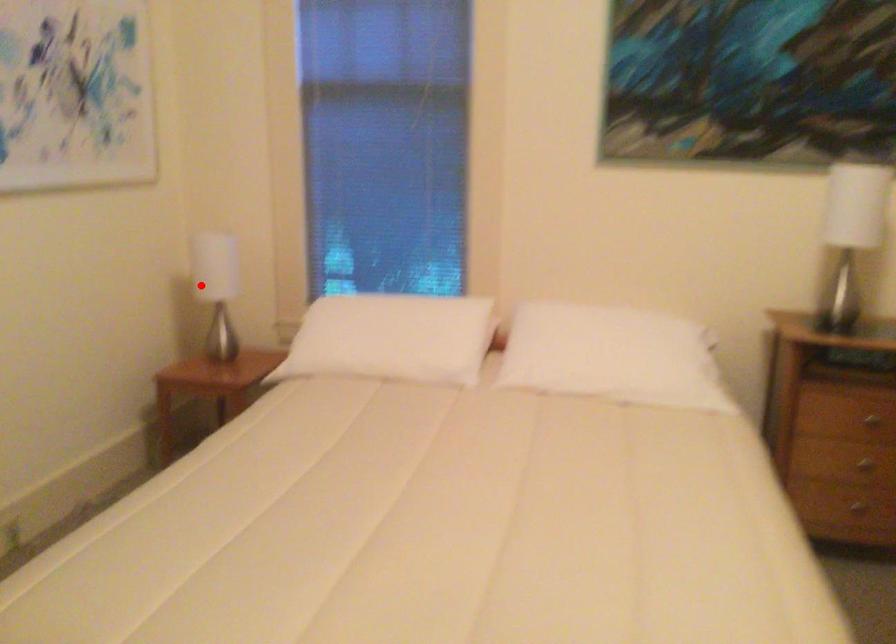
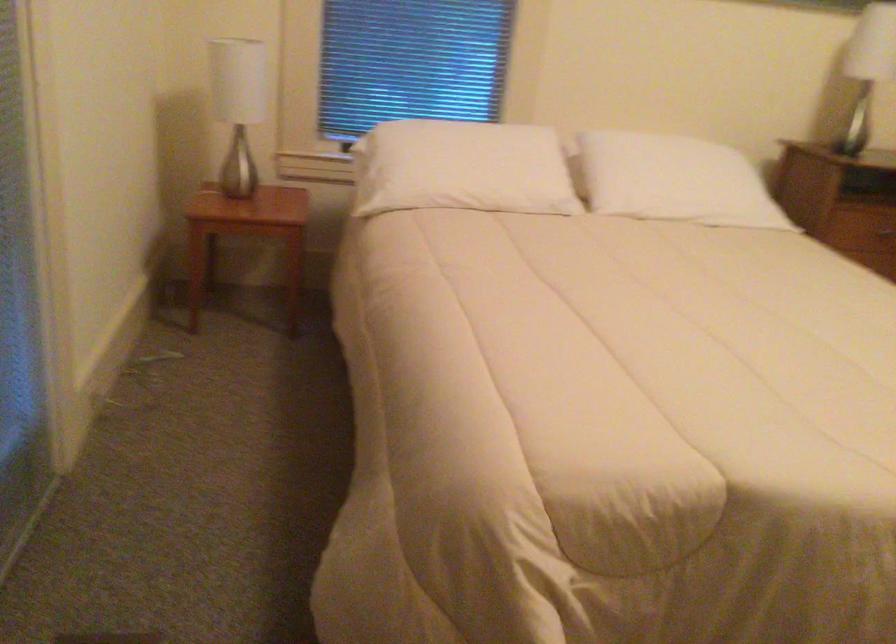
Locate, in the second image, the point that corresponds to the highlighted location in the first image.

(238, 106)